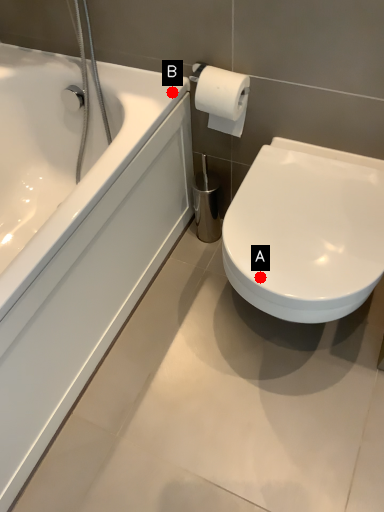
Question: Two points are circled on the image, labeled by A and B beside each circle. Which point is farther from the camera taking this photo?

Choices:
 (A) A is further
 (B) B is further

Answer: (B)